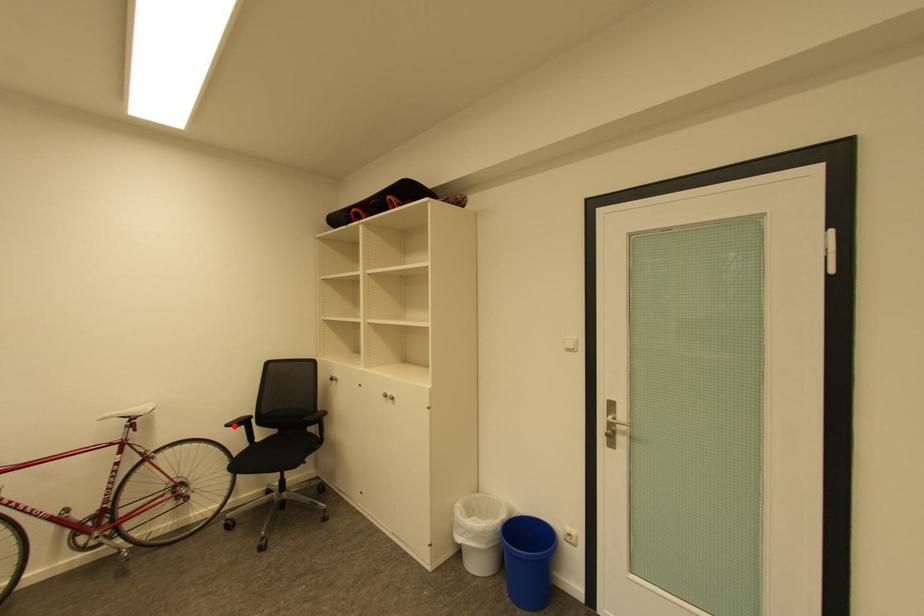
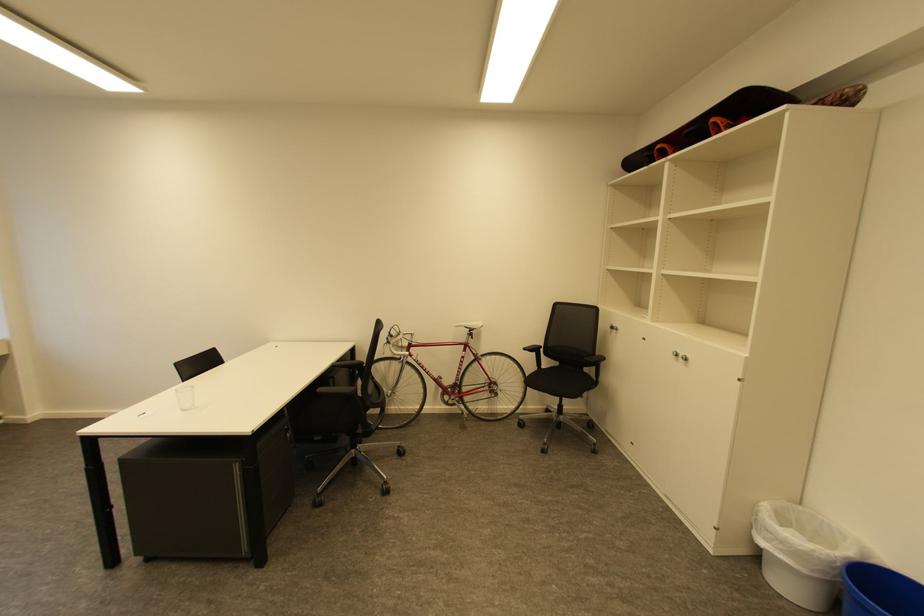
In the second image, find the point that corresponds to the highlighted location in the first image.

(531, 350)